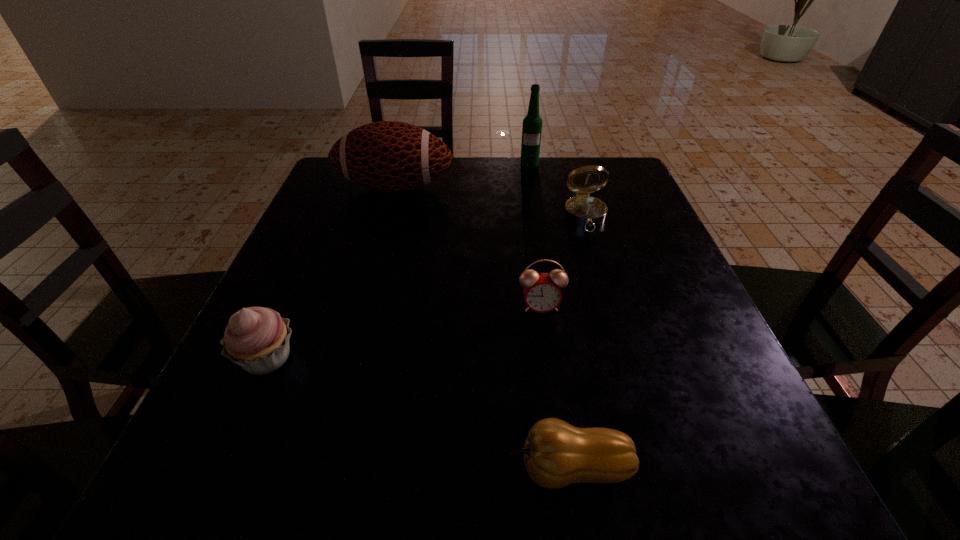
The height and width of the screenshot is (540, 960). I want to click on the tallest object, so click(532, 124).

You are a GUI agent. You are given a task and a screenshot of the screen. Output one action in this format:
    pyautogui.click(x=<x>, y=<y>)
    Task: Click on the beer bottle
    The image size is (960, 540).
    Given the screenshot: What is the action you would take?
    point(532,124)

Locate an element on the screen. the second tallest object is located at coordinates (388, 156).

Locate an element on the screen. compass is located at coordinates 582,210.

The height and width of the screenshot is (540, 960). What are the coordinates of `cupcake` in the screenshot? It's located at (256, 338).

Identify the location of alarm clock. tap(542, 293).

This screenshot has height=540, width=960. I want to click on the nearest object, so click(556, 454).

Find the location of a particular element. This screenshot has height=540, width=960. gourd is located at coordinates (556, 454).

This screenshot has width=960, height=540. I want to click on vacant region located on the label of the beer bottle, so click(x=538, y=210).

You are a GUI agent. You are given a task and a screenshot of the screen. Output one action in this format:
    pyautogui.click(x=<x>, y=<y>)
    Task: Click on the free space located 0.160m on the front of the football
    
    Given the screenshot: What is the action you would take?
    pyautogui.click(x=378, y=247)